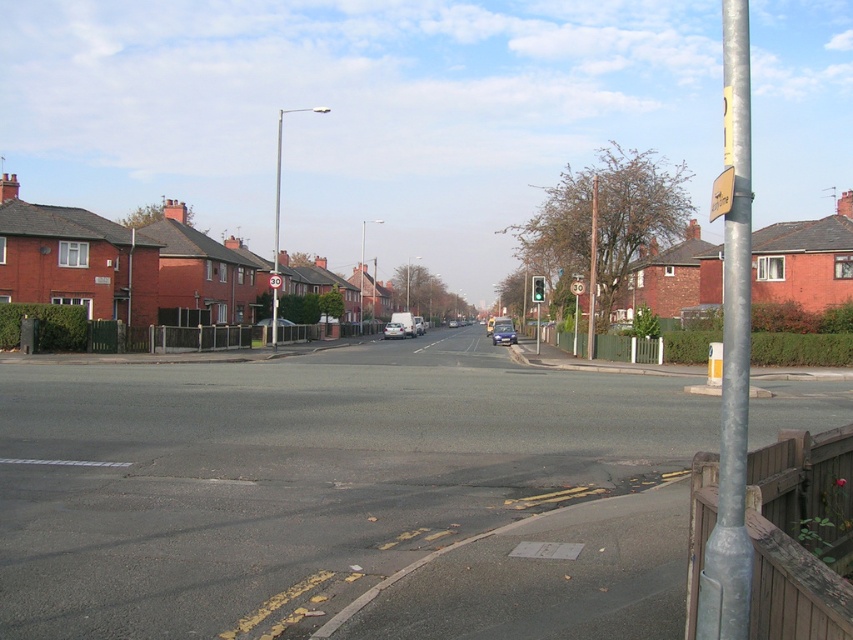
You are a delivery driver approaching the residential street. You see a white matte van at center and a red plastic sign at center. Which object is directly above the other?

The white matte van at center is positioned under the red plastic sign at center, so the red plastic sign at center is directly above the white matte van at center.

You are driving a matte silver van at center and want to see the metallic circular speed limit sign at center. Which direction should you look to see it?

The metallic circular speed limit sign at center is located above the matte silver van at center, so you should look upward to see it.

You are driving a car and see the metallic circular speed limit sign at center and the matte silver van at center ahead. Which object is closer to you?

The metallic circular speed limit sign at center is closer to you because it is in front of the matte silver van at center.